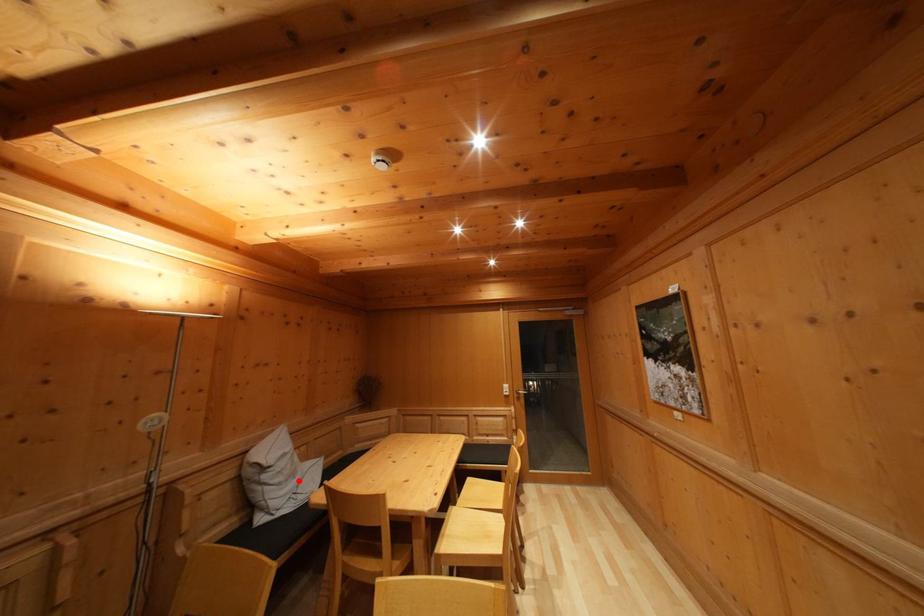
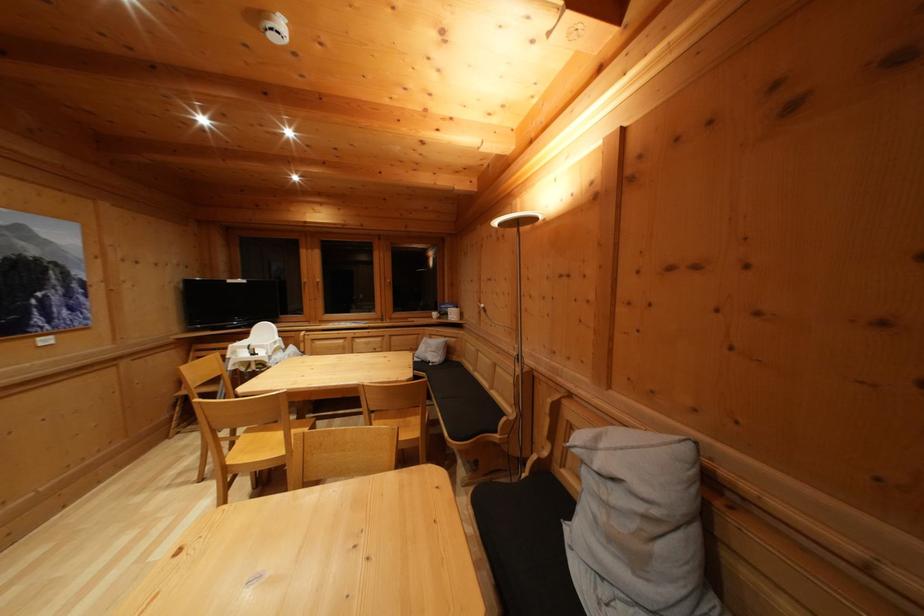
Locate, in the second image, the point that corresponds to the highlighted location in the first image.

(640, 565)